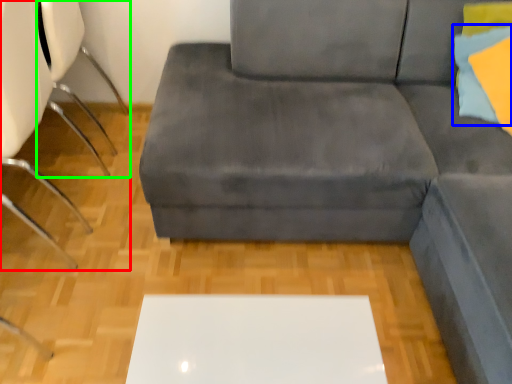
Question: Estimate the real-world distances between objects in this image. Which object is farther from chair (highlighted by a red box), pillow (highlighted by a blue box) or swivel chair (highlighted by a green box)?

Choices:
 (A) pillow
 (B) swivel chair

Answer: (A)